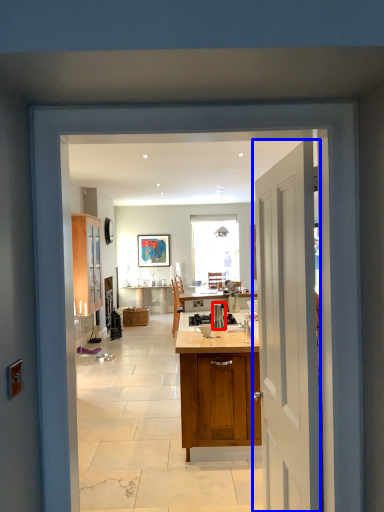
Question: Which of the following is the closest to the observer, kitchen appliance (highlighted by a red box) or door (highlighted by a blue box)?

Choices:
 (A) kitchen appliance
 (B) door

Answer: (B)